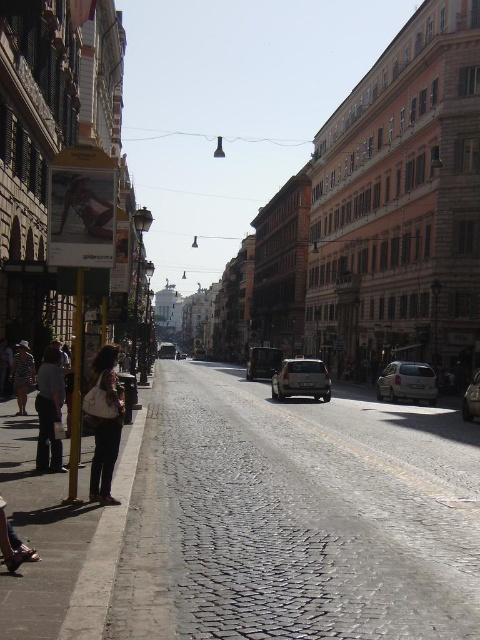
Question: Which object is farther from the camera taking this photo?

Choices:
 (A) cobblestone pavement at center
 (B) denim pants at lower left
 (C) beige fabric bikini at center

Answer: (B)

Question: Which point is farther from the camera taking this photo?

Choices:
 (A) (278, 353)
 (B) (123, 492)
 (C) (275, 376)

Answer: (A)

Question: Which object is farther from the camera taking this photo?

Choices:
 (A) shiny black car at center
 (B) leather shoes at lower left
 (C) beige fabric bikini at center
 (D) cobblestone pavement at center

Answer: (A)

Question: Does cobblestone pavement at center have a smaller size compared to white concrete curb at lower left?

Choices:
 (A) no
 (B) yes

Answer: (A)

Question: Can you confirm if white matte hatchback at center-right is positioned to the right of satin silver suv at center?

Choices:
 (A) yes
 (B) no

Answer: (A)

Question: Can you confirm if cobblestone pavement at center is bigger than shiny black car at center?

Choices:
 (A) yes
 (B) no

Answer: (B)